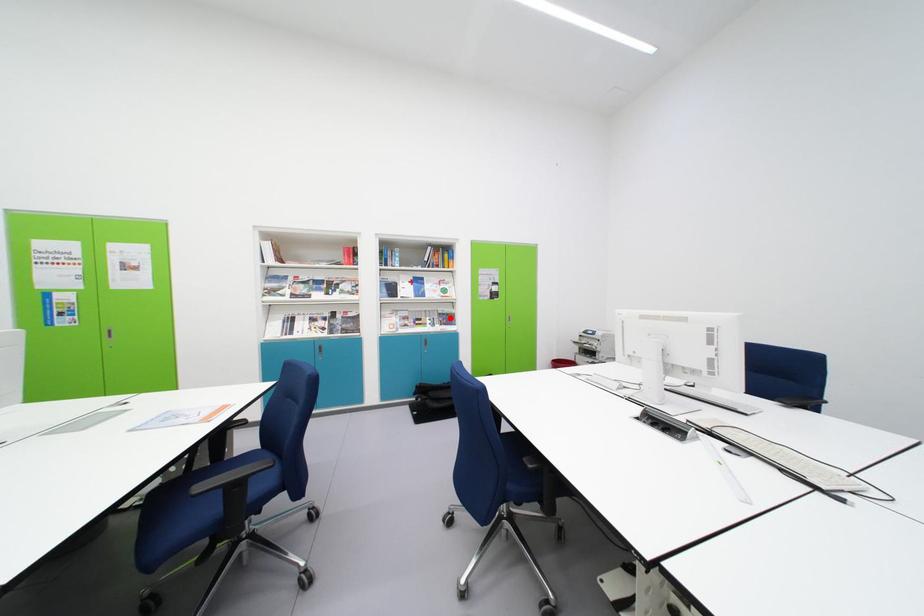
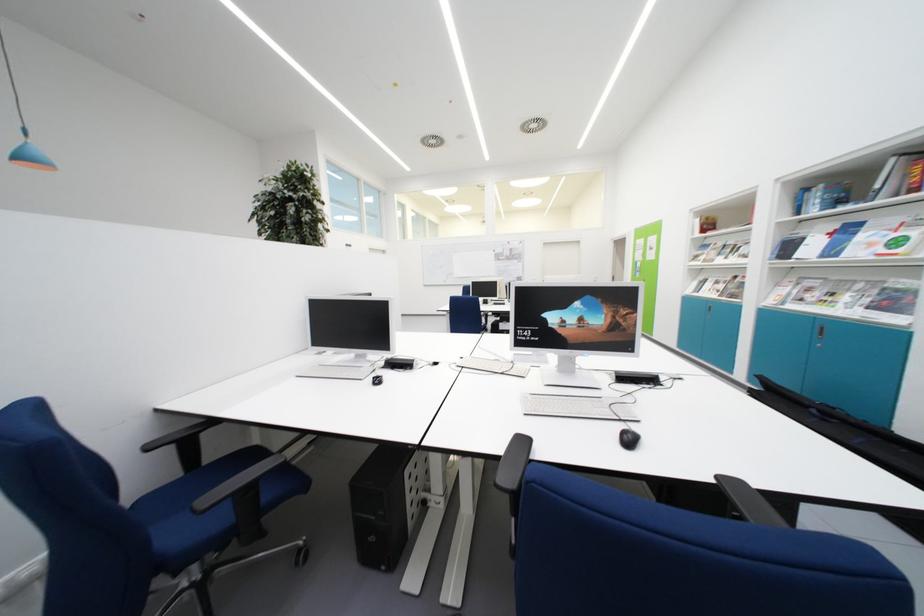
Where in the second image is the point corresponding to the highlighted location from the first image?

(903, 294)